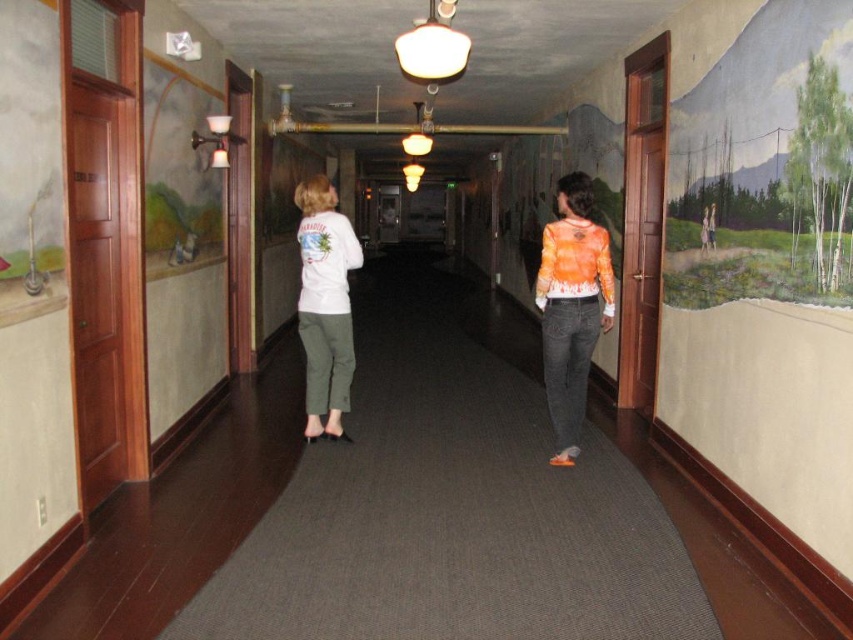
Question: Is orange tie-dye shirt at center thinner than white matte shirt at center?

Choices:
 (A) yes
 (B) no

Answer: (A)

Question: Is orange tie-dye shirt at center positioned behind white matte shirt at center?

Choices:
 (A) yes
 (B) no

Answer: (B)

Question: Which point is farther to the camera?

Choices:
 (A) (538, 276)
 (B) (311, 250)

Answer: (B)

Question: Observing the image, what is the correct spatial positioning of orange tie-dye shirt at center in reference to white matte shirt at center?

Choices:
 (A) right
 (B) left

Answer: (A)